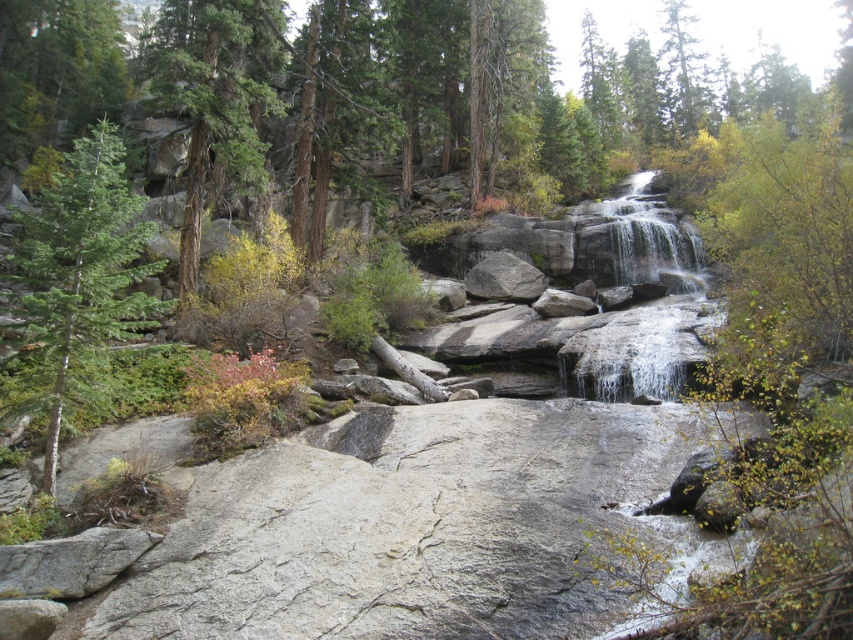
Image resolution: width=853 pixels, height=640 pixels. Describe the element at coordinates (215, 97) in the screenshot. I see `green textured tree at left` at that location.

Is point (178, 38) positioned before point (509, 264)?

That is True.

Describe the element at coordinates (215, 97) in the screenshot. This screenshot has width=853, height=640. I see `green textured tree at left` at that location.

Find the location of a particular element. green textured tree at left is located at coordinates (215, 97).

Is green textured tree at upper center taller than gray rough rock at center?

Correct, green textured tree at upper center is much taller as gray rough rock at center.

Measure the distance between green textured tree at upper center and gray rough rock at center.

They are 57.60 meters apart.

The image size is (853, 640). What are the coordinates of `green textured tree at upper center` in the screenshot? It's located at (683, 70).

Between green textured tree at left and green textured tree at upper center, which one is positioned higher?

Positioned higher is green textured tree at upper center.

Which is behind, point (181, 282) or point (677, 61)?

Positioned behind is point (677, 61).

Locate an element on the screen. The width and height of the screenshot is (853, 640). green textured tree at left is located at coordinates (215, 97).